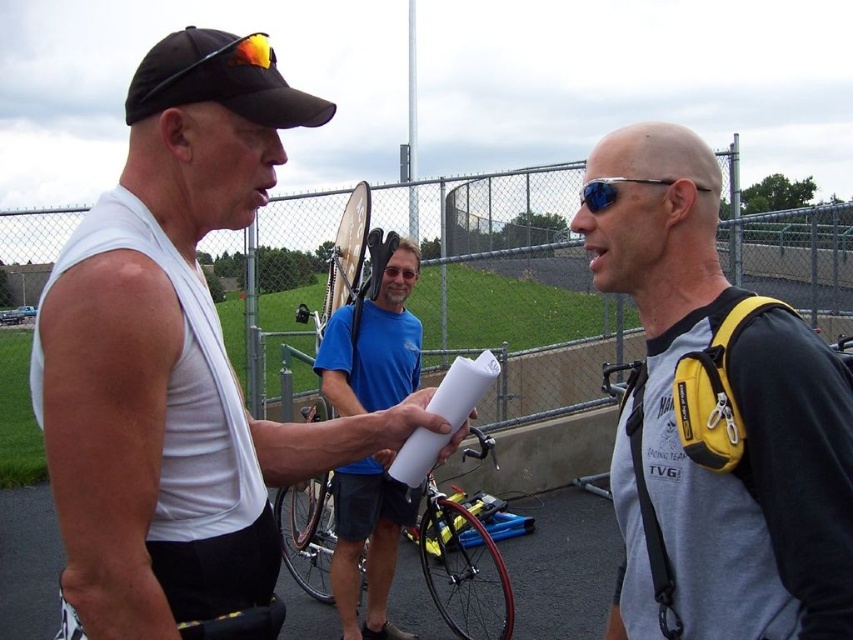
Question: Which of the following is the closest to the observer?

Choices:
 (A) blue reflective lens sunglasses at center
 (B) white paper at center

Answer: (A)

Question: Does gray matte backpack at center appear on the right side of black matte baseball cap at upper left?

Choices:
 (A) no
 (B) yes

Answer: (B)

Question: Is shiny red bicycle at center closer to the viewer compared to black matte baseball cap at upper left?

Choices:
 (A) yes
 (B) no

Answer: (B)

Question: Is white matte tank top at center positioned behind shiny red bicycle at center?

Choices:
 (A) yes
 (B) no

Answer: (B)

Question: Among these objects, which one is farthest from the camera?

Choices:
 (A) white matte tank top at center
 (B) gray matte backpack at center
 (C) white paper at center

Answer: (C)

Question: Which object is farther from the camera taking this photo?

Choices:
 (A) gray matte backpack at center
 (B) blue reflective lens sunglasses at center

Answer: (B)